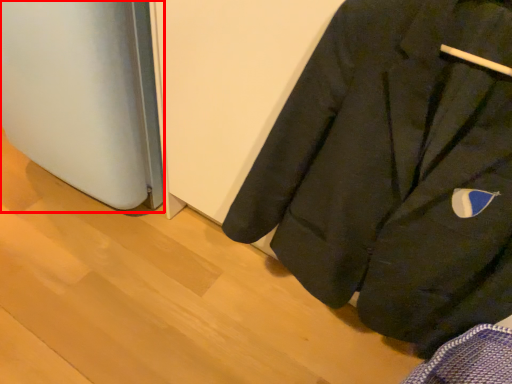
Question: From the image, what is the correct spatial relationship of appliance (annotated by the red box) in relation to coat?

Choices:
 (A) left
 (B) right

Answer: (A)